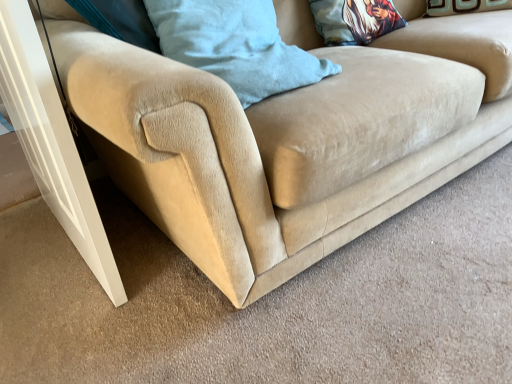
Question: Is printed fabric pillow at upper center, which appears as the first pillow when viewed from the right, oriented away from corduroy blue pillow at upper center, which appears as the first pillow when viewed from the front?

Choices:
 (A) no
 (B) yes

Answer: (A)

Question: From a real-world perspective, is printed fabric pillow at upper center, the 2th pillow when ordered from front to back, over corduroy blue pillow at upper center, marked as the 1th pillow in a left-to-right arrangement?

Choices:
 (A) no
 (B) yes

Answer: (A)

Question: Does printed fabric pillow at upper center, which appears as the first pillow when viewed from the right, have a greater height compared to corduroy blue pillow at upper center, which appears as the first pillow when viewed from the front?

Choices:
 (A) no
 (B) yes

Answer: (A)

Question: Is printed fabric pillow at upper center, the 2th pillow when ordered from front to back, far from corduroy blue pillow at upper center, which appears as the first pillow when viewed from the front?

Choices:
 (A) yes
 (B) no

Answer: (B)

Question: Is printed fabric pillow at upper center, arranged as the second pillow when viewed from the left, at the right side of corduroy blue pillow at upper center, marked as the 1th pillow in a left-to-right arrangement?

Choices:
 (A) no
 (B) yes

Answer: (B)

Question: From a real-world perspective, does printed fabric pillow at upper center, acting as the 1th pillow starting from the back, sit lower than corduroy blue pillow at upper center, marked as the 1th pillow in a left-to-right arrangement?

Choices:
 (A) no
 (B) yes

Answer: (B)

Question: Considering the relative sizes of corduroy blue pillow at upper center, the second pillow from the back, and printed fabric pillow at upper center, arranged as the second pillow when viewed from the left, in the image provided, is corduroy blue pillow at upper center, the second pillow from the back, wider than printed fabric pillow at upper center, arranged as the second pillow when viewed from the left,?

Choices:
 (A) no
 (B) yes

Answer: (B)

Question: Can you confirm if corduroy blue pillow at upper center, the second pillow from the back, is smaller than printed fabric pillow at upper center, arranged as the second pillow when viewed from the left?

Choices:
 (A) yes
 (B) no

Answer: (B)

Question: Is corduroy blue pillow at upper center, which appears as the first pillow when viewed from the front, positioned in front of printed fabric pillow at upper center, acting as the 1th pillow starting from the back?

Choices:
 (A) no
 (B) yes

Answer: (B)

Question: Is corduroy blue pillow at upper center, the second pillow from the back, to the right of printed fabric pillow at upper center, arranged as the second pillow when viewed from the left, from the viewer's perspective?

Choices:
 (A) yes
 (B) no

Answer: (B)

Question: From a real-world perspective, is corduroy blue pillow at upper center, the second pillow from the back, over printed fabric pillow at upper center, which appears as the first pillow when viewed from the right?

Choices:
 (A) no
 (B) yes

Answer: (B)

Question: Is corduroy blue pillow at upper center, which appears as the first pillow when viewed from the front, far from printed fabric pillow at upper center, acting as the 1th pillow starting from the back?

Choices:
 (A) no
 (B) yes

Answer: (A)

Question: Can you confirm if corduroy blue pillow at upper center, the second pillow from the back, is taller than white glossy screen door at lower left?

Choices:
 (A) yes
 (B) no

Answer: (B)